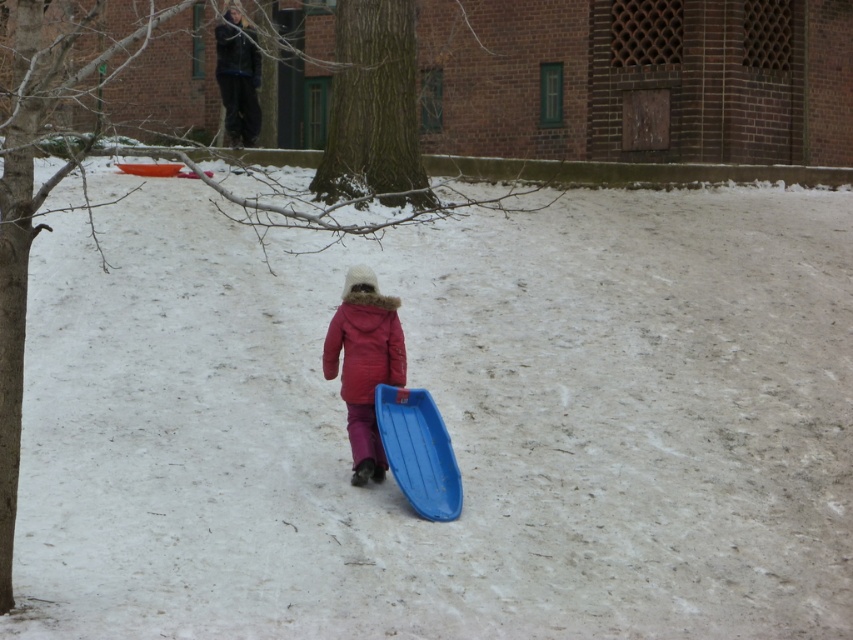
Which is in front, point (347, 358) or point (437, 433)?

Positioned in front is point (437, 433).

Measure the distance between point (351, 323) and camera.

A distance of 11.61 meters exists between point (351, 323) and camera.

Locate an element on the screen. This screenshot has height=640, width=853. matte pink coat at center is located at coordinates (364, 364).